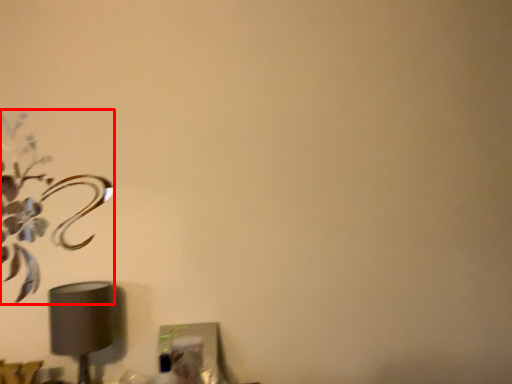
Question: From the image's perspective, what is the correct spatial positioning of flower (annotated by the red box) in reference to lamp?

Choices:
 (A) below
 (B) above

Answer: (B)